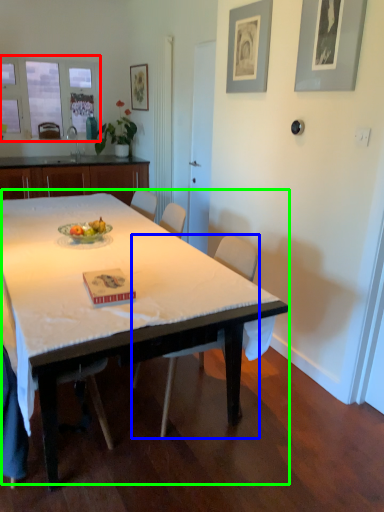
Question: Estimate the real-world distances between objects in this image. Which object is farther from window screen (highlighted by a red box), chair (highlighted by a blue box) or table (highlighted by a green box)?

Choices:
 (A) chair
 (B) table

Answer: (A)